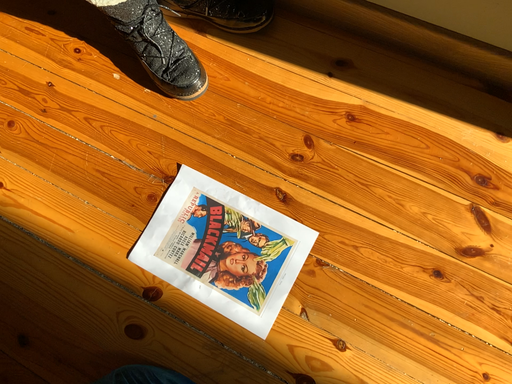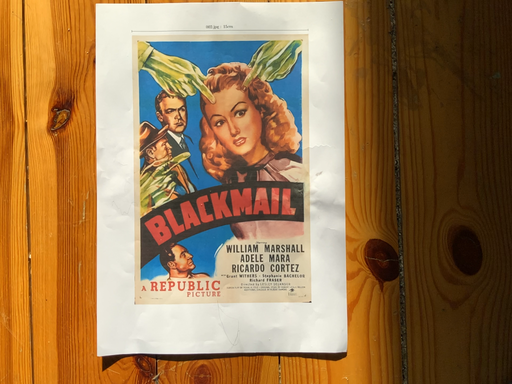
Question: How did the camera likely rotate when shooting the video?

Choices:
 (A) rotated right
 (B) rotated left

Answer: (A)